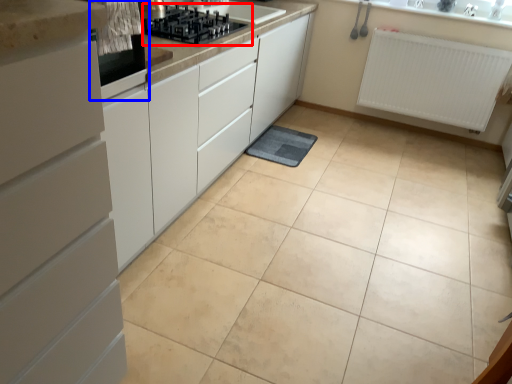
Question: Which object is further to the camera taking this photo, gas stove (highlighted by a red box) or home appliance (highlighted by a blue box)?

Choices:
 (A) gas stove
 (B) home appliance

Answer: (A)